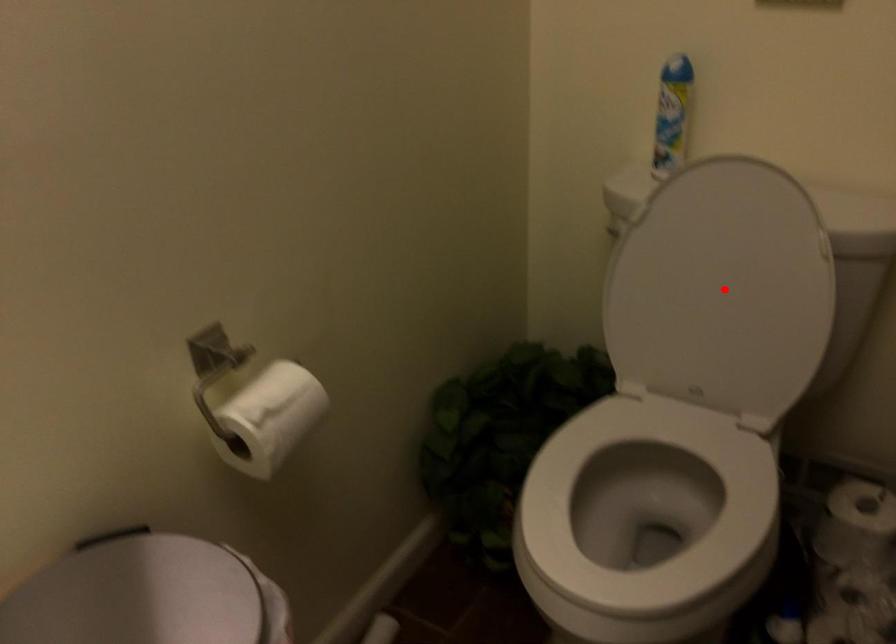
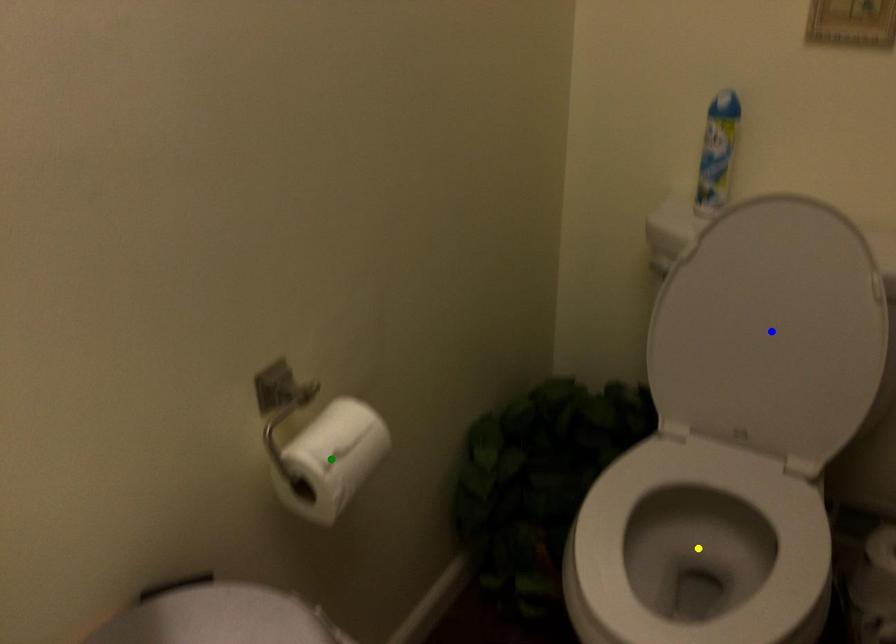
Question: I am providing you with two images of the same scene from different viewpoints. A red point is marked on the first image. You are given multiple points on the second image. Which mark in image 2 goes with the point in image 1?

Choices:
 (A) green point
 (B) blue point
 (C) yellow point

Answer: (B)